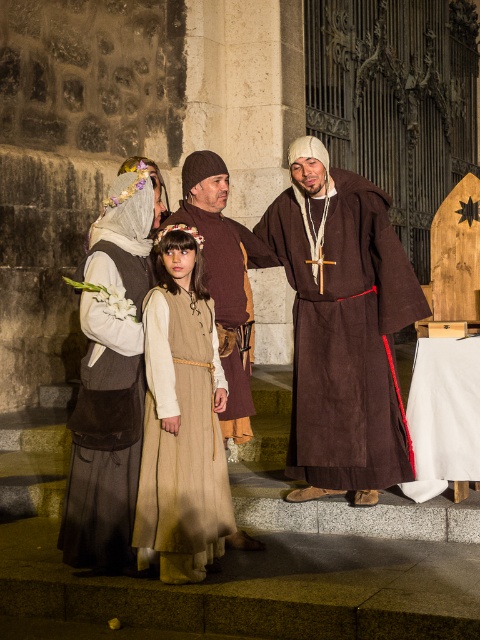
Based on the scene description, which object is taller between the brown suede robe at center and the matte brown vest at center?

The brown suede robe at center is much taller than the matte brown vest at center.

You are a costume designer observing the scene. You need to determine which costume requires more fabric to create between the brown suede robe at center and the beige fabric dress at center. Which one would require more fabric?

The brown suede robe at center is larger in size than the beige fabric dress at center, so it would require more fabric to create.

You are standing in front of the church scene and want to determine which of the two points, point (350, 324) or point (188, 468), is closer to you. Based on the spatial arrangement, which point is nearer?

Point (350, 324) is further to the viewer than point (188, 468). Wait, but the question asks which is closer to you. Hmm, the description says point 0.509 is further to the viewer than point 0.734. So if point A is further than point B, then point B is closer. So the answer should be point (188, 468) is closer.